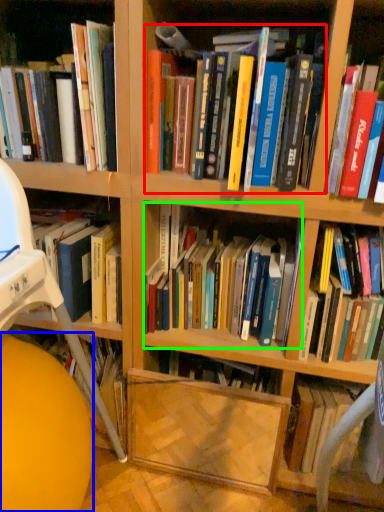
Question: Which is farther away from book (highlighted by a red box)? ball (highlighted by a blue box) or book (highlighted by a green box)?

Choices:
 (A) ball
 (B) book

Answer: (A)